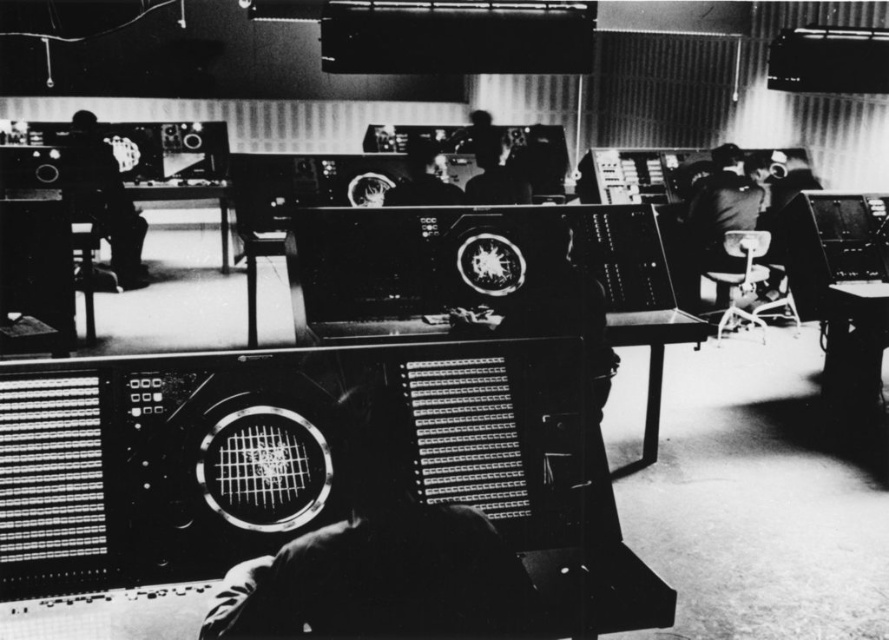
Question: Can you confirm if metallic panel at center is bigger than silhouette of person at left?

Choices:
 (A) yes
 (B) no

Answer: (B)

Question: Which object is positioned farthest from the silhouette of person at left?

Choices:
 (A) metallic panel at center
 (B) smooth black head at center

Answer: (A)

Question: Which point is farther to the camera?

Choices:
 (A) smooth black head at center
 (B) silhouette of person at left
 (C) metallic panel at center

Answer: (B)

Question: Does metallic panel at center have a greater width compared to smooth black head at center?

Choices:
 (A) yes
 (B) no

Answer: (A)

Question: Which point is farther from the camera taking this photo?

Choices:
 (A) (284, 572)
 (B) (119, 241)
 (C) (437, 170)

Answer: (B)

Question: Observing the image, what is the correct spatial positioning of metallic panel at center in reference to silhouette of person at left?

Choices:
 (A) left
 (B) right

Answer: (B)